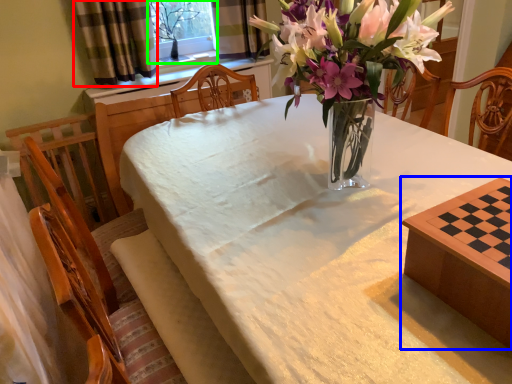
Question: Which is nearer to the curtain (highlighted by a red box)? table (highlighted by a blue box) or window screen (highlighted by a green box).

Choices:
 (A) table
 (B) window screen

Answer: (B)